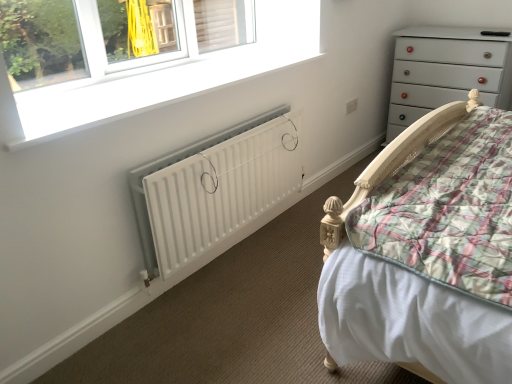
Question: Is white matte radiator at lower center not within white matte window at upper left?

Choices:
 (A) no
 (B) yes

Answer: (B)

Question: From the image's perspective, would you say white matte radiator at lower center is positioned over white matte window at upper left?

Choices:
 (A) yes
 (B) no

Answer: (B)

Question: Does white matte radiator at lower center have a greater width compared to white matte window at upper left?

Choices:
 (A) yes
 (B) no

Answer: (B)

Question: Is white matte radiator at lower center positioned behind white matte window at upper left?

Choices:
 (A) yes
 (B) no

Answer: (A)

Question: Does white matte radiator at lower center touch white matte window at upper left?

Choices:
 (A) no
 (B) yes

Answer: (A)

Question: From a real-world perspective, is white matte radiator at lower center on top of white matte window at upper left?

Choices:
 (A) no
 (B) yes

Answer: (A)

Question: Considering the relative sizes of white matte window at upper left and white glossy chest of drawers at upper right in the image provided, is white matte window at upper left bigger than white glossy chest of drawers at upper right?

Choices:
 (A) no
 (B) yes

Answer: (A)

Question: Is white matte window at upper left positioned behind white glossy chest of drawers at upper right?

Choices:
 (A) no
 (B) yes

Answer: (A)

Question: Is white matte window at upper left completely or partially outside of white glossy chest of drawers at upper right?

Choices:
 (A) yes
 (B) no

Answer: (A)

Question: Can you confirm if white matte window at upper left is positioned to the right of white glossy chest of drawers at upper right?

Choices:
 (A) no
 (B) yes

Answer: (A)

Question: Is white matte window at upper left shorter than white glossy chest of drawers at upper right?

Choices:
 (A) no
 (B) yes

Answer: (B)

Question: Can you see white matte window at upper left touching white glossy chest of drawers at upper right?

Choices:
 (A) no
 (B) yes

Answer: (A)

Question: Does white matte window at upper left appear on the right side of white matte radiator at lower center?

Choices:
 (A) yes
 (B) no

Answer: (B)